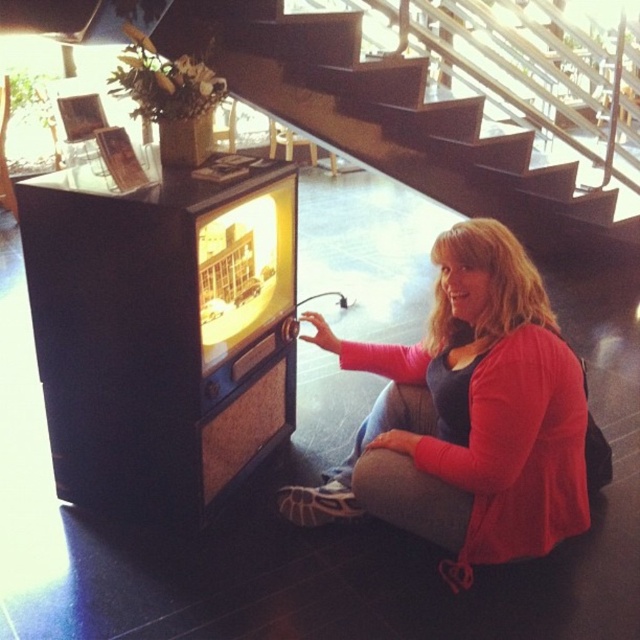
Question: Is pink fabric at lower center thinner than dark wood stairs at center?

Choices:
 (A) no
 (B) yes

Answer: (B)

Question: Which point is farther from the camera taking this photo?

Choices:
 (A) (280, 77)
 (B) (476, 381)

Answer: (A)

Question: Which point is closer to the camera taking this photo?

Choices:
 (A) (493, 225)
 (B) (268, 92)

Answer: (A)

Question: Does pink fabric at lower center have a greater width compared to dark wood stairs at center?

Choices:
 (A) no
 (B) yes

Answer: (A)

Question: Does pink fabric at lower center appear on the right side of dark wood stairs at center?

Choices:
 (A) no
 (B) yes

Answer: (A)